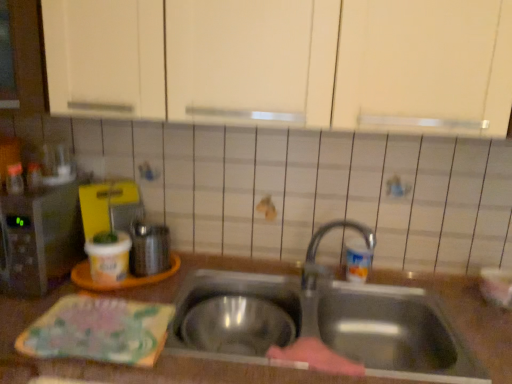
Locate an element on the screen. The width and height of the screenshot is (512, 384). stainless steel sink at center is located at coordinates (316, 323).

Measure the distance between point (396, 347) and camera.

Point (396, 347) is 1.31 meters from camera.

At what (x,y) coordinates should I click in order to perform the action: click on metallic microwave at left, marked as the first appliance in a left-to-right arrangement. Please return your answer as a coordinate pair (x, y). Looking at the image, I should click on (40, 238).

Where is `stainless steel sink at center`? This screenshot has width=512, height=384. stainless steel sink at center is located at coordinates (316, 323).

Between metallic microwave at left, the second appliance positioned from the right, and shiny metallic kettle at left, the 2th appliance when ordered from left to right, which one has smaller size?

With smaller size is shiny metallic kettle at left, the 2th appliance when ordered from left to right.

Considering the positions of point (49, 219) and point (159, 232), is point (49, 219) closer or farther from the camera than point (159, 232)?

Point (49, 219) is positioned closer to the camera compared to point (159, 232).

Looking at this image, does metallic microwave at left, marked as the first appliance in a left-to-right arrangement, come in front of shiny metallic kettle at left, the 2th appliance when ordered from left to right?

Yes, metallic microwave at left, marked as the first appliance in a left-to-right arrangement, is closer to the viewer.

Is brown matte countertop at center with stainless steel sink at center?

No, brown matte countertop at center is not touching stainless steel sink at center.

Considering the relative positions of brown matte countertop at center and stainless steel sink at center in the image provided, is brown matte countertop at center to the right of stainless steel sink at center from the viewer's perspective?

Incorrect, brown matte countertop at center is not on the right side of stainless steel sink at center.

From the image's perspective, relative to stainless steel sink at center, is brown matte countertop at center above or below?

brown matte countertop at center is below stainless steel sink at center.

Is metallic microwave at left, marked as the first appliance in a left-to-right arrangement, next to stainless steel sink at center?

No, metallic microwave at left, marked as the first appliance in a left-to-right arrangement, is not next to stainless steel sink at center.

Measure the distance between metallic microwave at left, the second appliance positioned from the right, and stainless steel sink at center.

metallic microwave at left, the second appliance positioned from the right, is 23.17 inches from stainless steel sink at center.

Is metallic microwave at left, the second appliance positioned from the right, positioned with its back to stainless steel sink at center?

No, metallic microwave at left, the second appliance positioned from the right, is not facing away from stainless steel sink at center.

From the image's perspective, is metallic microwave at left, the second appliance positioned from the right, over stainless steel sink at center?

Yes, from the image's perspective, metallic microwave at left, the second appliance positioned from the right, is above stainless steel sink at center.

Considering the sizes of objects stainless steel sink at center and brown matte countertop at center in the image provided, who is bigger, stainless steel sink at center or brown matte countertop at center?

brown matte countertop at center is bigger.

From the image's perspective, between stainless steel sink at center and brown matte countertop at center, who is located below?

From the image's view, brown matte countertop at center is below.

Is stainless steel sink at center oriented away from brown matte countertop at center?

Correct, stainless steel sink at center is looking away from brown matte countertop at center.

From a real-world perspective, which object stands above the other?

From a 3D spatial view, stainless steel sink at center is above.

Is stainless steel sink at center closer to camera compared to shiny metallic kettle at left, the 2th appliance when ordered from left to right?

Yes, stainless steel sink at center is closer to the camera.

Can we say stainless steel sink at center lies outside shiny metallic kettle at left, which ranks as the first appliance in right-to-left order?

Indeed, stainless steel sink at center is completely outside shiny metallic kettle at left, which ranks as the first appliance in right-to-left order.

Consider the image. From the image's perspective, relative to shiny metallic kettle at left, the 2th appliance when ordered from left to right, is stainless steel sink at center above or below?

stainless steel sink at center is below shiny metallic kettle at left, the 2th appliance when ordered from left to right.

Which point is more distant from viewer, (187,349) or (134,229)?

Point (134,229)

Looking at this image, how different are the orientations of stainless steel sink at center and metallic microwave at left, marked as the first appliance in a left-to-right arrangement, in degrees?

2.26 degrees separate the facing orientations of stainless steel sink at center and metallic microwave at left, marked as the first appliance in a left-to-right arrangement.

Is stainless steel sink at center positioned before metallic microwave at left, marked as the first appliance in a left-to-right arrangement?

Yes.

Is there a large distance between stainless steel sink at center and metallic microwave at left, marked as the first appliance in a left-to-right arrangement?

No, stainless steel sink at center is not far away from metallic microwave at left, marked as the first appliance in a left-to-right arrangement.

Is stainless steel sink at center wider than metallic microwave at left, marked as the first appliance in a left-to-right arrangement?

Yes.

Based on the photo, from a real-world perspective, between shiny metallic kettle at left, the 2th appliance when ordered from left to right, and metallic microwave at left, the second appliance positioned from the right, who is vertically higher?

metallic microwave at left, the second appliance positioned from the right, from a real-world perspective.

Is point (152, 270) positioned before point (45, 220)?

No, it is behind (45, 220).

Considering the positions of objects shiny metallic kettle at left, which ranks as the first appliance in right-to-left order, and metallic microwave at left, the second appliance positioned from the right, in the image provided, who is behind, shiny metallic kettle at left, which ranks as the first appliance in right-to-left order, or metallic microwave at left, the second appliance positioned from the right,?

shiny metallic kettle at left, which ranks as the first appliance in right-to-left order, is more distant.

Is shiny metallic kettle at left, which ranks as the first appliance in right-to-left order, to the left or to the right of metallic microwave at left, the second appliance positioned from the right, in the image?

From the image, it's evident that shiny metallic kettle at left, which ranks as the first appliance in right-to-left order, is to the right of metallic microwave at left, the second appliance positioned from the right.

I want to click on appliance below the metallic microwave at left, the second appliance positioned from the right (from the image's perspective), so click(x=149, y=249).

The width and height of the screenshot is (512, 384). Identify the location of countertop located in front of the stainless steel sink at center. (134, 368).

When comparing their distances from brown matte countertop at center, does stainless steel sink at center or metallic microwave at left, marked as the first appliance in a left-to-right arrangement, seem closer?

stainless steel sink at center lies closer to brown matte countertop at center than the other object.

Which object lies further to the anchor point brown matte countertop at center, shiny metallic kettle at left, which ranks as the first appliance in right-to-left order, or stainless steel sink at center?

shiny metallic kettle at left, which ranks as the first appliance in right-to-left order, is positioned further to the anchor brown matte countertop at center.

Based on their spatial positions, is metallic microwave at left, marked as the first appliance in a left-to-right arrangement, or shiny metallic kettle at left, the 2th appliance when ordered from left to right, further from brown matte countertop at center?

Among the two, shiny metallic kettle at left, the 2th appliance when ordered from left to right, is located further to brown matte countertop at center.

Estimate the real-world distances between objects in this image. Which object is closer to metallic microwave at left, marked as the first appliance in a left-to-right arrangement, brown matte countertop at center or stainless steel sink at center?

Among the two, brown matte countertop at center is located nearer to metallic microwave at left, marked as the first appliance in a left-to-right arrangement.

Considering their positions, is metallic microwave at left, the second appliance positioned from the right, positioned closer to stainless steel sink at center than shiny metallic kettle at left, which ranks as the first appliance in right-to-left order?

The object closer to stainless steel sink at center is shiny metallic kettle at left, which ranks as the first appliance in right-to-left order.

Based on their spatial positions, is brown matte countertop at center or metallic microwave at left, the second appliance positioned from the right, further from shiny metallic kettle at left, which ranks as the first appliance in right-to-left order?

brown matte countertop at center is positioned further to the anchor shiny metallic kettle at left, which ranks as the first appliance in right-to-left order.

Looking at the image, which one is located closer to metallic microwave at left, marked as the first appliance in a left-to-right arrangement, stainless steel sink at center or shiny metallic kettle at left, which ranks as the first appliance in right-to-left order?

The object closer to metallic microwave at left, marked as the first appliance in a left-to-right arrangement, is shiny metallic kettle at left, which ranks as the first appliance in right-to-left order.

Considering their positions, is stainless steel sink at center positioned closer to metallic microwave at left, the second appliance positioned from the right, than brown matte countertop at center?

The object closer to metallic microwave at left, the second appliance positioned from the right, is brown matte countertop at center.

Where is `appliance between metallic microwave at left, marked as the first appliance in a left-to-right arrangement, and stainless steel sink at center, in the horizontal direction`? appliance between metallic microwave at left, marked as the first appliance in a left-to-right arrangement, and stainless steel sink at center, in the horizontal direction is located at coordinates (149, 249).

I want to click on countertop located between metallic microwave at left, the second appliance positioned from the right, and stainless steel sink at center in the left-right direction, so click(x=134, y=368).

The height and width of the screenshot is (384, 512). Identify the location of appliance between metallic microwave at left, marked as the first appliance in a left-to-right arrangement, and brown matte countertop at center. point(149,249).

This screenshot has height=384, width=512. Identify the location of sink between brown matte countertop at center and shiny metallic kettle at left, which ranks as the first appliance in right-to-left order, in the front-back direction. 316,323.